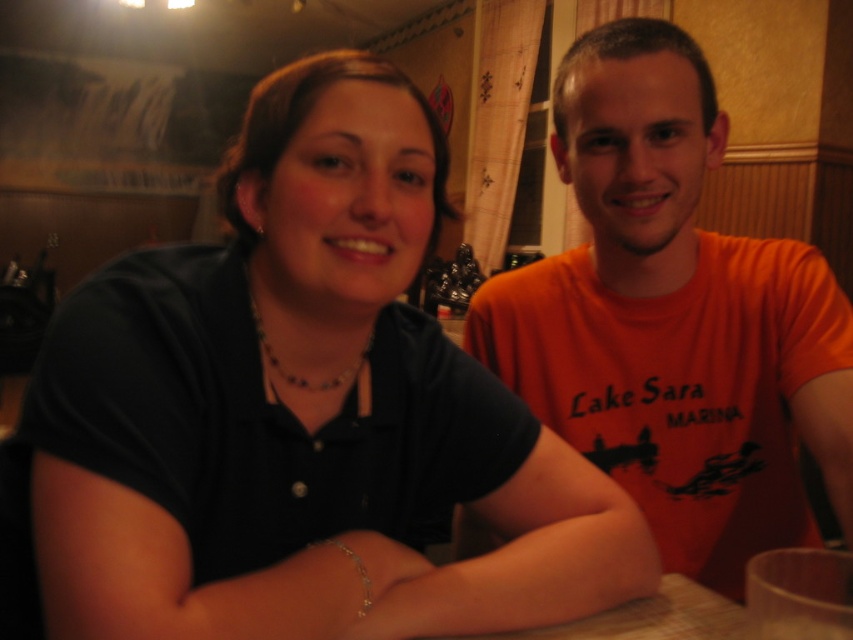
Looking at this image, can you confirm if black matte shirt at center is wider than orange cotton t-shirt at center?

Yes.

Between black matte shirt at center and orange cotton t-shirt at center, which one appears on the left side from the viewer's perspective?

From the viewer's perspective, black matte shirt at center appears more on the left side.

Who is more distant from viewer, (242, 131) or (635, 33)?

The point (635, 33) is more distant.

This screenshot has width=853, height=640. Find the location of `black matte shirt at center`. black matte shirt at center is located at coordinates (303, 412).